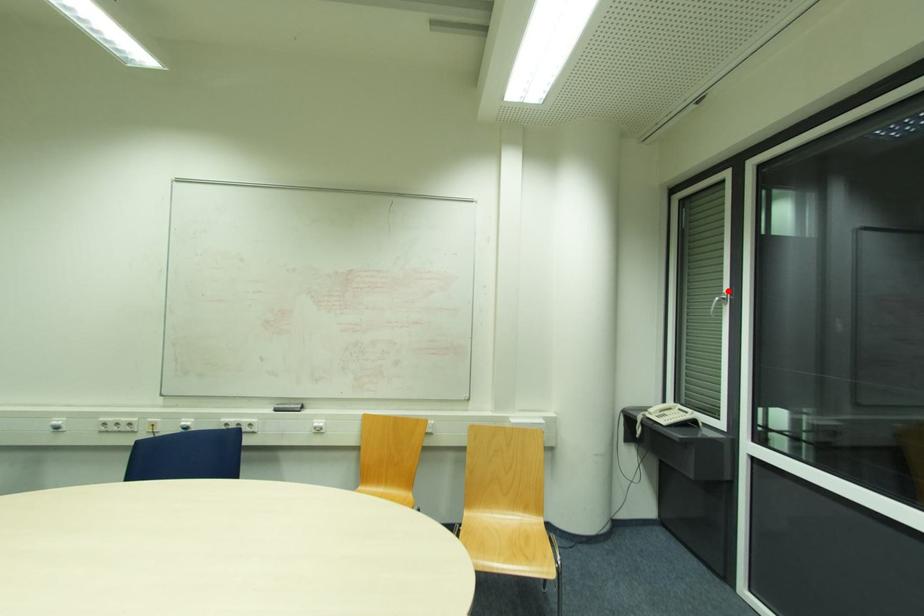
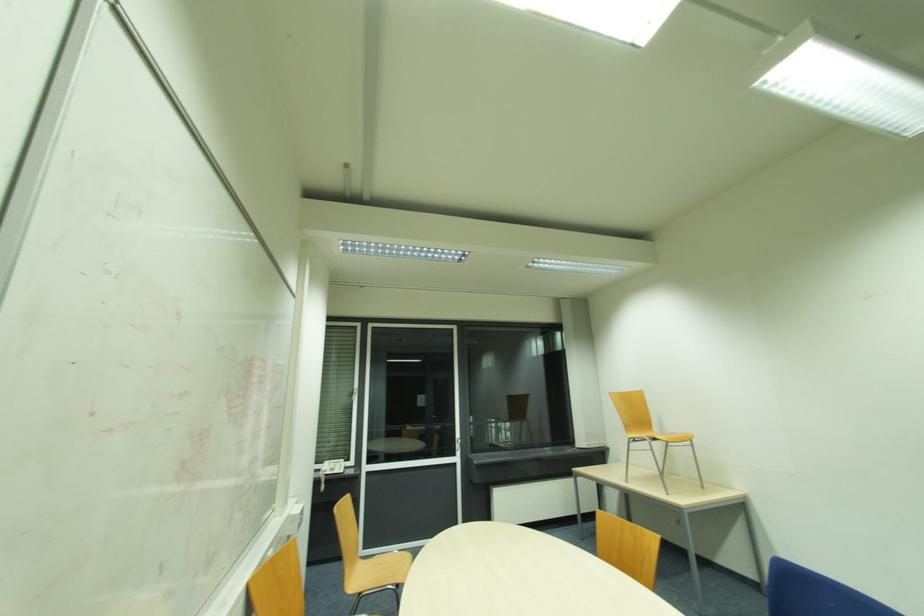
Question: I am providing you with two images of the same scene from different viewpoints. Image1 has a red point marked. In image2, the corresponding 3D location appears at what relative position? Reply with the corresponding letter.

Choices:
 (A) Closer
 (B) Farther

Answer: (B)